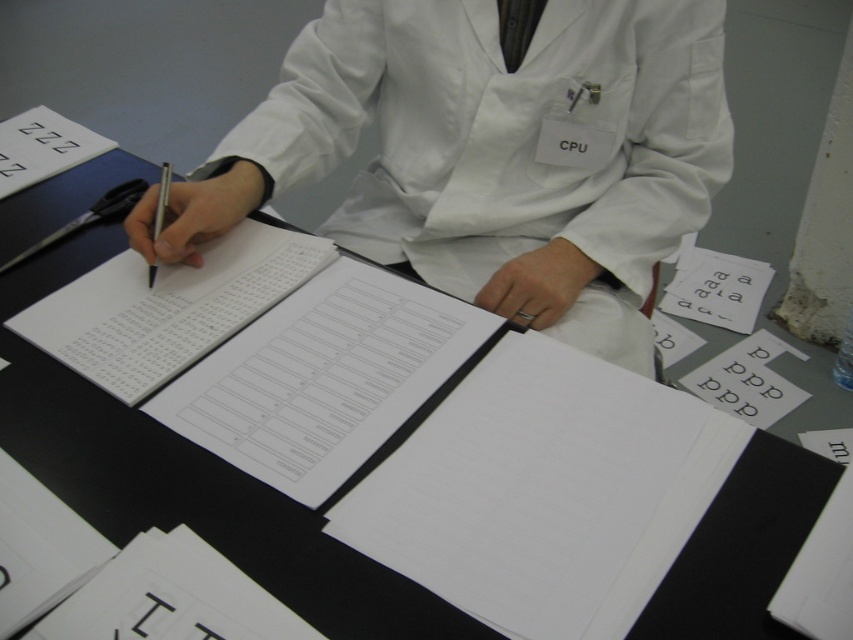
Is white smooth lab coat at center further to camera compared to metallic silver pen at left?

Yes, it is.

Is white smooth lab coat at center to the right of metallic silver pen at left from the viewer's perspective?

Correct, you'll find white smooth lab coat at center to the right of metallic silver pen at left.

Between point (550, 122) and point (157, 220), which one is positioned in front?

Positioned in front is point (157, 220).

What are the coordinates of `white smooth lab coat at center` in the screenshot? It's located at (508, 141).